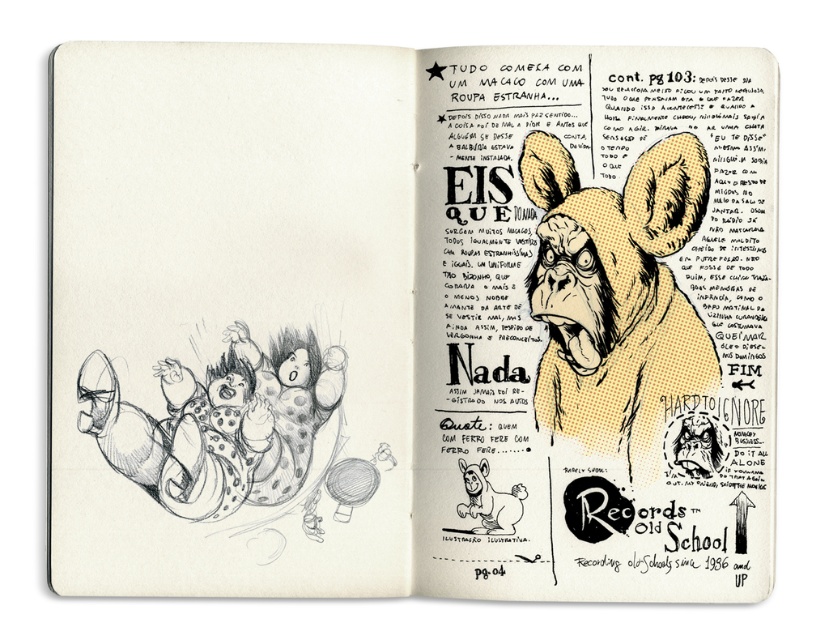
Question: Which point is farther to the camera?

Choices:
 (A) yellow dotted fabric monkey at upper right
 (B) black and white sketch of children at left

Answer: (A)

Question: Is yellow dotted fabric monkey at upper right thinner than black and white sketch of children at left?

Choices:
 (A) no
 (B) yes

Answer: (B)

Question: Which point appears closest to the camera in this image?

Choices:
 (A) (x=308, y=460)
 (B) (x=604, y=310)

Answer: (A)

Question: Is the position of yellow dotted fabric monkey at upper right less distant than that of black and white sketch of children at left?

Choices:
 (A) no
 (B) yes

Answer: (A)

Question: Observing the image, what is the correct spatial positioning of yellow dotted fabric monkey at upper right in reference to black and white sketch of children at left?

Choices:
 (A) right
 (B) left

Answer: (A)